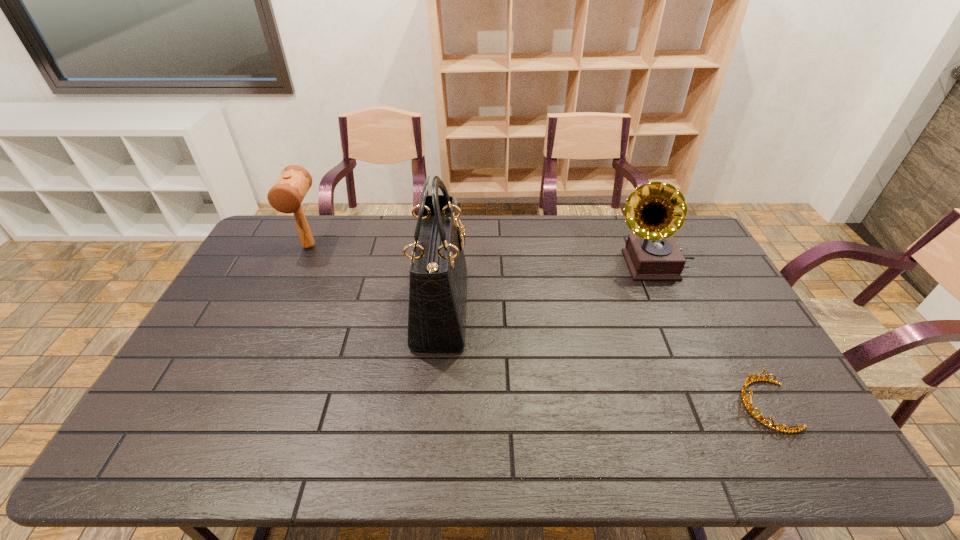
Identify the location of free space between the tallest object and the shortest object. (604, 357).

You are a GUI agent. You are given a task and a screenshot of the screen. Output one action in this format:
    pyautogui.click(x=<x>, y=<y>)
    Task: Click on the free space between the third object from right to left and the leftmost object
    
    Given the screenshot: What is the action you would take?
    pyautogui.click(x=374, y=278)

Identify the location of free area in between the leftmost object and the phonograph record. The width and height of the screenshot is (960, 540). (480, 255).

The width and height of the screenshot is (960, 540). In order to click on free space between the nearest object and the mallet in this screenshot , I will do `click(538, 326)`.

The image size is (960, 540). I want to click on vacant region between the phonograph record and the third object from right to left, so click(x=545, y=287).

Where is `vacant area between the phonograph record and the handbag`? The height and width of the screenshot is (540, 960). vacant area between the phonograph record and the handbag is located at coordinates (545, 287).

At what (x,y) coordinates should I click in order to perform the action: click on free space between the shortest object and the tallest object. Please return your answer as a coordinate pair (x, y). Image resolution: width=960 pixels, height=540 pixels. Looking at the image, I should click on (604, 357).

The image size is (960, 540). I want to click on free spot between the shortest object and the second object from left to right, so click(x=604, y=357).

Find the location of a particular element. Image resolution: width=960 pixels, height=540 pixels. object identified as the closest to the tallest object is located at coordinates (286, 195).

In order to click on the third closest object to the mallet in this screenshot , I will do `click(748, 381)`.